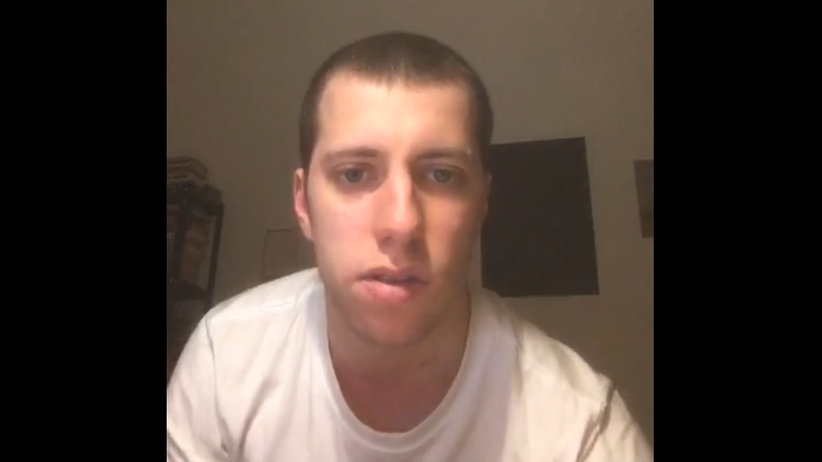
Where is `white wall`? The width and height of the screenshot is (822, 462). white wall is located at coordinates (567, 54).